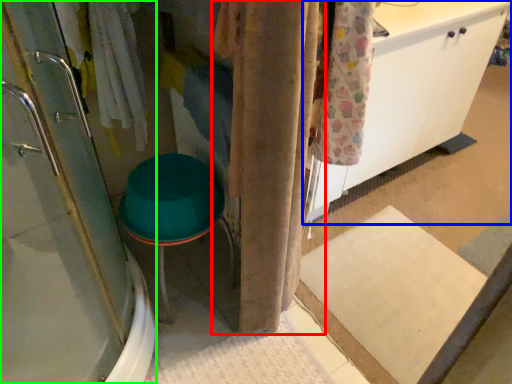
Question: Which object is positioned farthest from curtain (highlighted by a red box)? Select from cabinetry (highlighted by a blue box) and shower door (highlighted by a green box).

Choices:
 (A) cabinetry
 (B) shower door

Answer: (A)